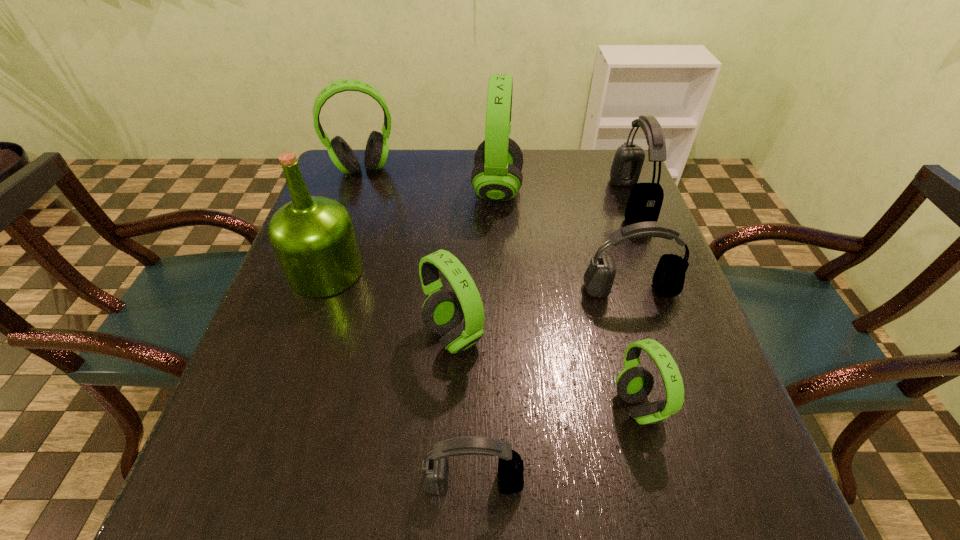
In order to click on the tallest headset in this screenshot , I will do `click(497, 176)`.

Locate an element on the screen. This screenshot has height=540, width=960. olive oil is located at coordinates (313, 237).

The image size is (960, 540). In order to click on the second biggest green headset in this screenshot , I will do `click(377, 148)`.

In order to click on the leftmost green headset in this screenshot , I will do `click(377, 148)`.

Locate an element on the screen. The height and width of the screenshot is (540, 960). the biggest black headset is located at coordinates (645, 200).

The image size is (960, 540). In order to click on the fifth farthest headset in this screenshot , I will do `click(443, 311)`.

Where is `the second smallest green headset`? The image size is (960, 540). the second smallest green headset is located at coordinates (443, 311).

At what (x,y) coordinates should I click in order to perform the action: click on the fourth nearest headset. Please return your answer as a coordinate pair (x, y). The height and width of the screenshot is (540, 960). Looking at the image, I should click on (668, 280).

In order to click on the second nearest black headset in this screenshot , I will do `click(668, 280)`.

The height and width of the screenshot is (540, 960). I want to click on the smallest green headset, so point(634,384).